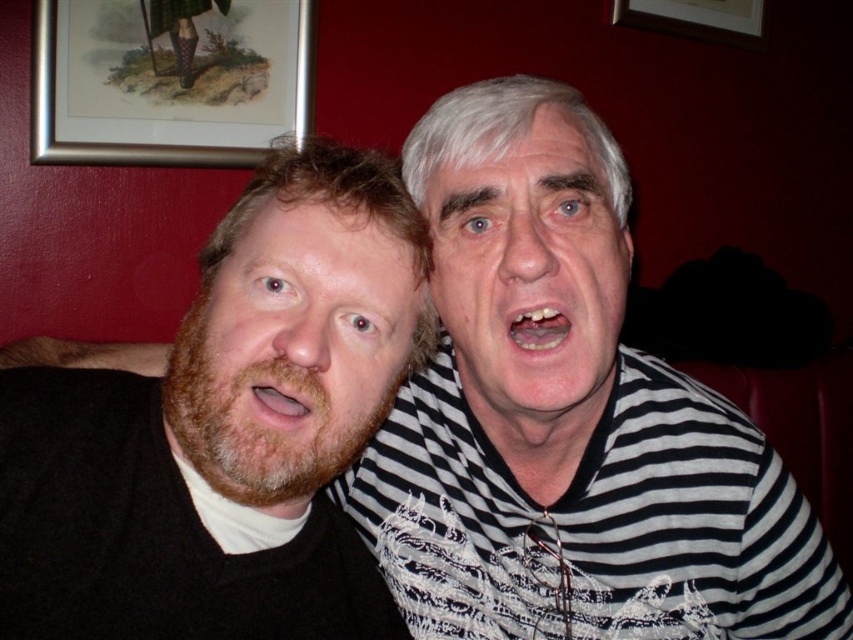
Is point (625, 20) positioned after point (273, 387)?

Yes, it is behind point (273, 387).

Which is behind, point (688, 16) or point (308, 420)?

The point (688, 16) is behind.

Identify the location of wooden picture frame at upper center. (695, 19).

Based on the photo, does brownwoollybeard at left come behind silver metallic picture frame at upper left?

Result: No, brownwoollybeard at left is closer to the viewer.

Identify the location of brownwoollybeard at left. This screenshot has height=640, width=853. (292, 349).

The image size is (853, 640). Identify the location of brownwoollybeard at left. (292, 349).

Can you confirm if silver metallic picture frame at upper left is positioned to the left of matte brown beard at lower left?

Yes, silver metallic picture frame at upper left is to the left of matte brown beard at lower left.

Which is in front, point (64, 29) or point (262, 380)?

Positioned in front is point (262, 380).

Where is `silver metallic picture frame at upper left`? This screenshot has height=640, width=853. silver metallic picture frame at upper left is located at coordinates (167, 81).

Where is `silver metallic picture frame at upper left`? This screenshot has width=853, height=640. silver metallic picture frame at upper left is located at coordinates click(167, 81).